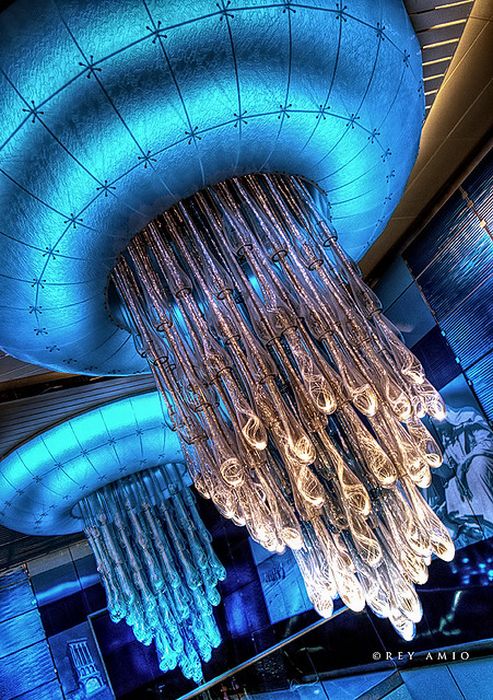
Identify the location of blue ceiling fixture. (118, 442), (160, 141).